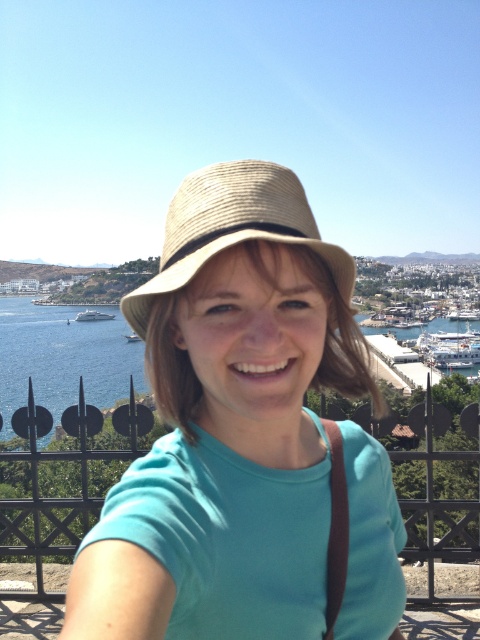
Is matte straw hat at center positioned before blue water at center?

Yes.

Does matte straw hat at center appear on the right side of blue water at center?

Result: No, matte straw hat at center is not to the right of blue water at center.

Locate an element on the screen. This screenshot has height=640, width=480. matte straw hat at center is located at coordinates 228,422.

What are the coordinates of `matte straw hat at center` in the screenshot? It's located at (228, 422).

Does natural straw hat at center have a greater height compared to blue water at center?

Incorrect, natural straw hat at center's height is not larger of blue water at center's.

Can you confirm if natural straw hat at center is shorter than blue water at center?

Yes.

I want to click on natural straw hat at center, so click(232, 228).

Where is `natural straw hat at center`? Image resolution: width=480 pixels, height=640 pixels. natural straw hat at center is located at coordinates (232, 228).

Who is more distant from viewer, (253, 547) or (290, 220)?

Positioned behind is point (290, 220).

In the scene shown: Does matte straw hat at center appear on the left side of natural straw hat at center?

No, matte straw hat at center is not to the left of natural straw hat at center.

Find the location of a particular element. matte straw hat at center is located at coordinates (228, 422).

This screenshot has height=640, width=480. Identify the location of matte straw hat at center. (228, 422).